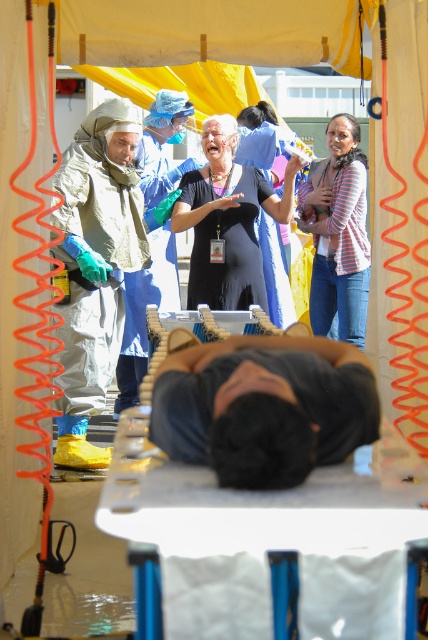
Question: Which point is farther from the camera taking this photo?

Choices:
 (A) (345, 310)
 (B) (116, 221)
 (C) (231, 301)
 (D) (128, 323)

Answer: (A)

Question: Among these objects, which one is nearest to the camera?

Choices:
 (A) dark blue fabric at center
 (B) dark brown leather bag at center

Answer: (A)

Question: Is dark blue fabric at center above matte hazmat suit at left?

Choices:
 (A) no
 (B) yes

Answer: (A)

Question: Is dark blue fabric at center below black matte dress at center?

Choices:
 (A) no
 (B) yes

Answer: (B)

Question: Is matte hazmat suit at left positioned at the back of black matte dress at center?

Choices:
 (A) no
 (B) yes

Answer: (A)

Question: Among these points, which one is farthest from the camera?

Choices:
 (A) (255, 177)
 (B) (321, 406)
 (C) (92, 230)

Answer: (A)